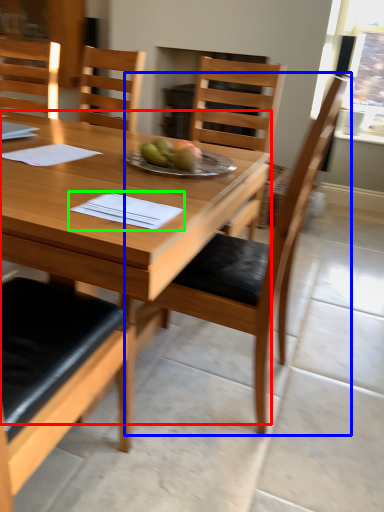
Question: Estimate the real-world distances between objects in this image. Which object is farther from desk (highlighted by a red box), chair (highlighted by a blue box) or notebook (highlighted by a green box)?

Choices:
 (A) chair
 (B) notebook

Answer: (A)